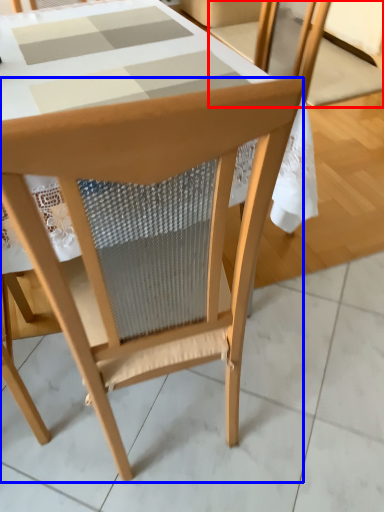
Question: Which point is closer to the camera, chair (highlighted by a red box) or chair (highlighted by a blue box)?

Choices:
 (A) chair
 (B) chair

Answer: (B)